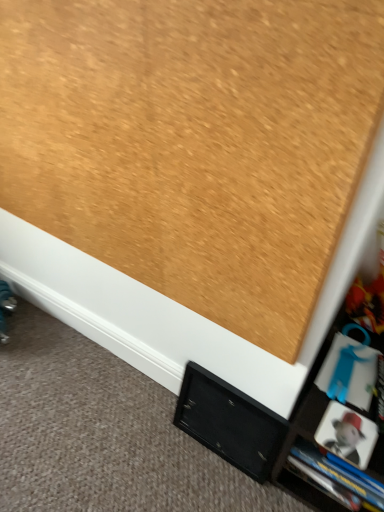
Question: Is blue plastic book at lower right touching black matte cabinet at lower center?

Choices:
 (A) yes
 (B) no

Answer: (B)

Question: Is blue plastic book at lower right at the right side of black matte cabinet at lower center?

Choices:
 (A) no
 (B) yes

Answer: (B)

Question: From a real-world perspective, is blue plastic book at lower right physically above black matte cabinet at lower center?

Choices:
 (A) yes
 (B) no

Answer: (A)

Question: Is blue plastic book at lower right not within black matte cabinet at lower center?

Choices:
 (A) no
 (B) yes

Answer: (B)

Question: Does blue plastic book at lower right have a lesser height compared to black matte cabinet at lower center?

Choices:
 (A) no
 (B) yes

Answer: (B)

Question: Is blue plastic book at lower right aimed at black matte cabinet at lower center?

Choices:
 (A) no
 (B) yes

Answer: (A)

Question: Does black matte cabinet at lower center lie in front of blue plastic book at lower right?

Choices:
 (A) yes
 (B) no

Answer: (B)

Question: Can you confirm if black matte cabinet at lower center is positioned to the left of blue plastic book at lower right?

Choices:
 (A) yes
 (B) no

Answer: (A)

Question: Does black matte cabinet at lower center have a smaller size compared to blue plastic book at lower right?

Choices:
 (A) no
 (B) yes

Answer: (A)

Question: Can you confirm if black matte cabinet at lower center is taller than blue plastic book at lower right?

Choices:
 (A) no
 (B) yes

Answer: (B)

Question: Is black matte cabinet at lower center far from blue plastic book at lower right?

Choices:
 (A) no
 (B) yes

Answer: (A)

Question: Could you tell me if black matte cabinet at lower center is facing blue plastic book at lower right?

Choices:
 (A) no
 (B) yes

Answer: (A)

Question: Is blue plastic book at lower right looking in the opposite direction of matte black cabinet at lower right?

Choices:
 (A) no
 (B) yes

Answer: (A)